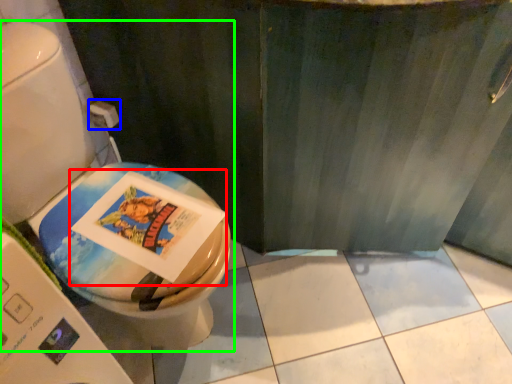
Question: Which is nearer to the comic book (highlighted by a red box)? toilet paper (highlighted by a blue box) or toilet (highlighted by a green box).

Choices:
 (A) toilet paper
 (B) toilet

Answer: (B)